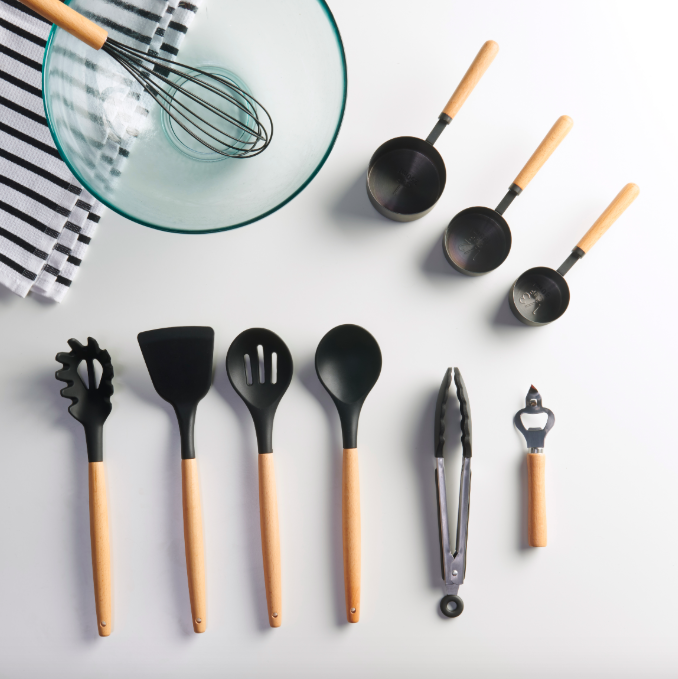
This screenshot has width=678, height=679. What are the coordinates of `glass bowl` in the screenshot? It's located at (252, 39).